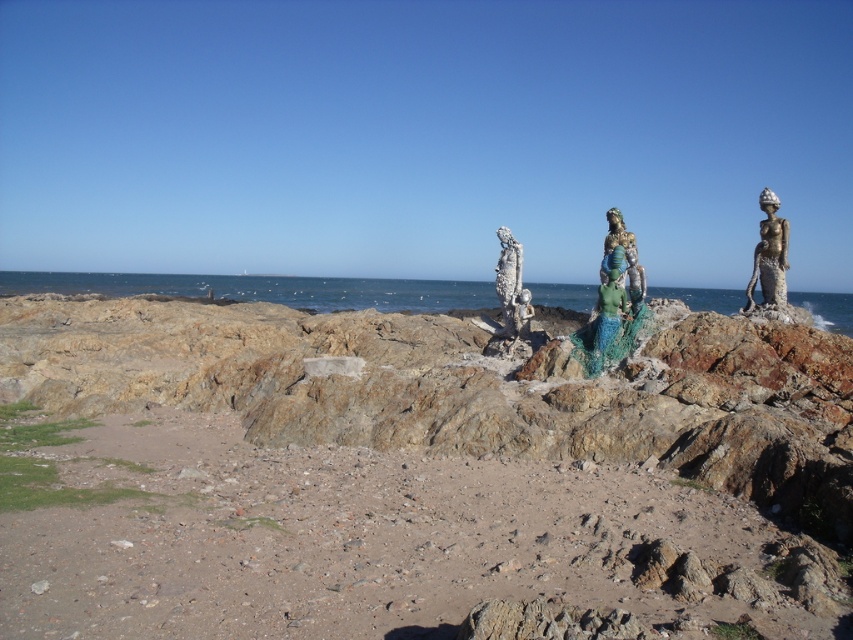
You are a photographer planning to take a picture of the brown sandy beach at lower left and the green fabric mermaid at center. You want to ensure both are visible in the frame. Based on their positions, which object should be placed on the left side of your photo?

The brown sandy beach at lower left is positioned on the left side of the green fabric mermaid at center, so to have both in the frame with the beach on the left, position the photo accordingly.

You are standing on the sandy beach in the coastal scene. You want to place a new statue exactly where the rusty metal statue at center is currently located. What are the coordinates of the spot where you should place your new statue?

The coordinates for the rusty metal statue at center are at point (511, 300), so you should place your new statue at those coordinates.

You are standing on the beach looking at the coastal scene with two points marked. Which of the two points, point (x=120, y=614) or point (x=782, y=248), is closer to you?

Point (x=120, y=614) is closer to the viewer than point (x=782, y=248).